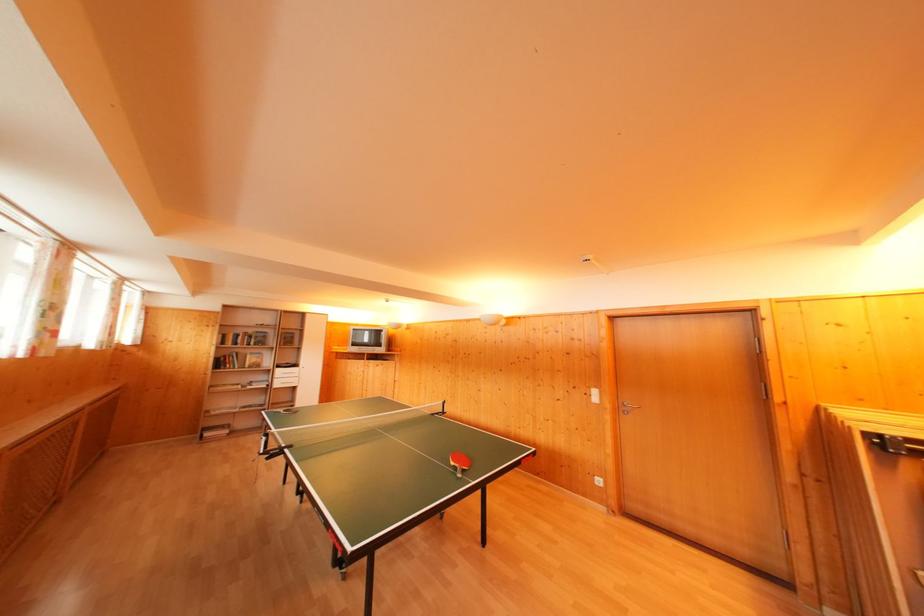
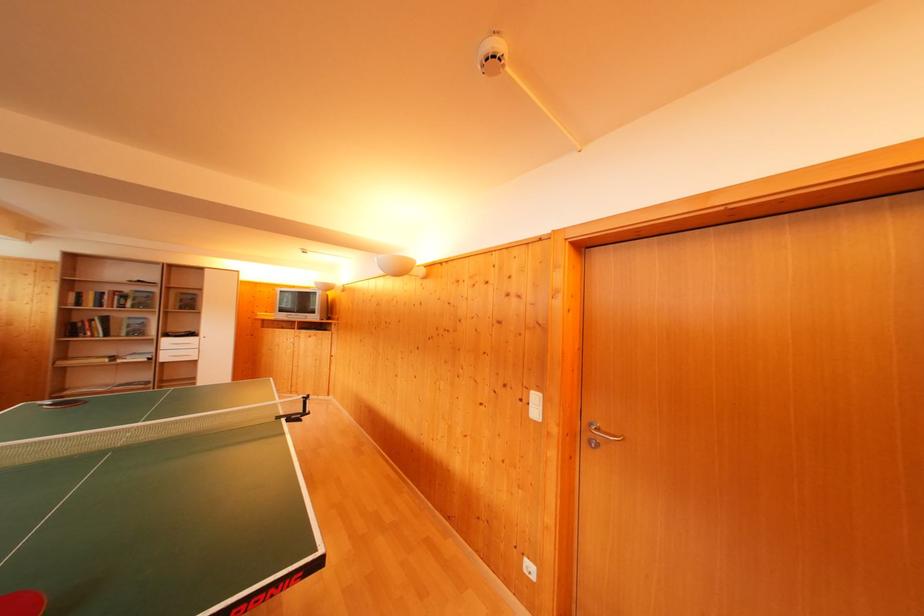
The point at (x=256, y=336) is marked in the first image. Where is the corresponding point in the second image?

(131, 294)